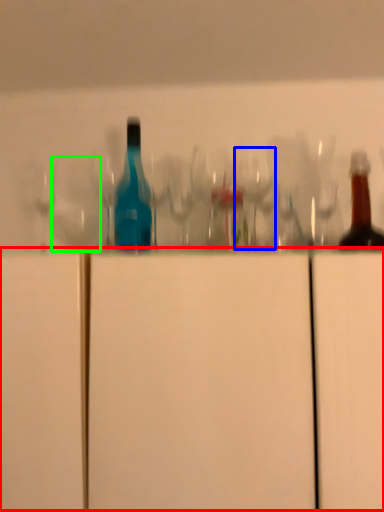
Question: Estimate the real-world distances between objects in this image. Which object is farther from cabinetry (highlighted by a red box), wine glass (highlighted by a blue box) or shot glass (highlighted by a green box)?

Choices:
 (A) wine glass
 (B) shot glass

Answer: (B)